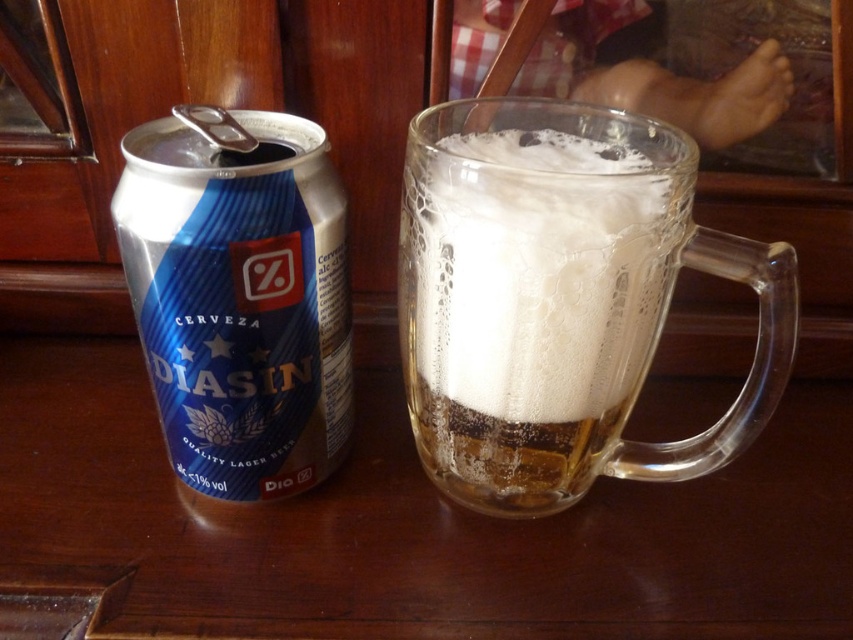
Is clear glass mug at center smaller than white frothy foam at upper center?

Actually, clear glass mug at center might be larger than white frothy foam at upper center.

Based on the photo, does clear glass mug at center appear on the left side of white frothy foam at upper center?

No, clear glass mug at center is not to the left of white frothy foam at upper center.

Does point (621, 172) come behind point (440, 243)?

Yes, it is.

At what (x,y) coordinates should I click in order to perform the action: click on clear glass mug at center. Please return your answer as a coordinate pair (x, y). This screenshot has height=640, width=853. Looking at the image, I should click on (560, 300).

Which of these two, clear glass mug at center or blue metallic can at left, stands shorter?

Standing shorter between the two is blue metallic can at left.

Between point (532, 118) and point (236, 248), which one is positioned in front?

Point (236, 248) is in front.

The height and width of the screenshot is (640, 853). Find the location of `clear glass mug at center`. clear glass mug at center is located at coordinates (560, 300).

Is blue metallic can at left behind white frothy foam at upper center?

Yes, blue metallic can at left is further from the viewer.

Describe the element at coordinates (239, 296) in the screenshot. I see `blue metallic can at left` at that location.

Is point (149, 211) less distant than point (535, 250)?

That is False.

Locate an element on the screen. blue metallic can at left is located at coordinates pos(239,296).